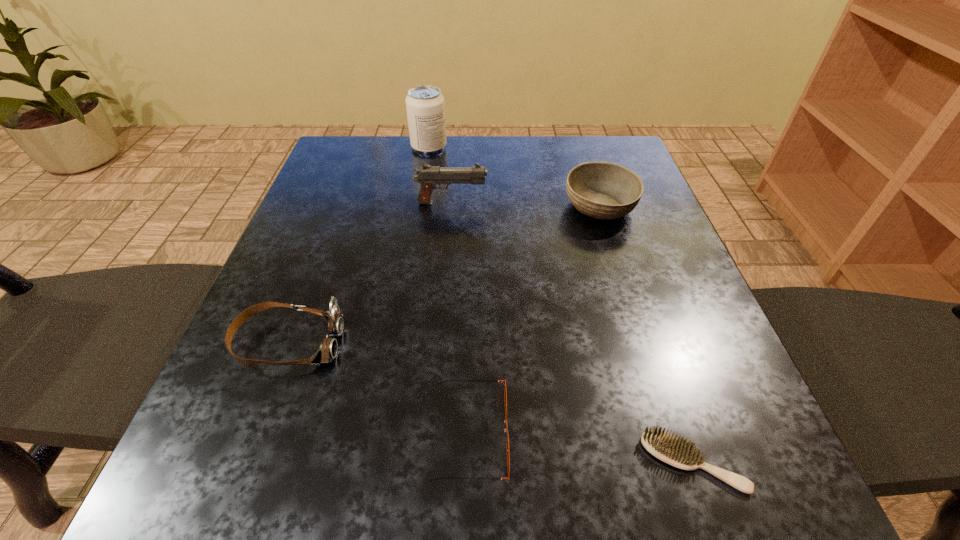
This screenshot has width=960, height=540. Identify the location of soda can. (425, 106).

Locate an element on the screen. This screenshot has width=960, height=540. the farthest object is located at coordinates (425, 106).

Where is `gun`? This screenshot has height=540, width=960. gun is located at coordinates (429, 177).

Find the location of a particular element. The width and height of the screenshot is (960, 540). the third tallest object is located at coordinates (603, 190).

At what (x,y) coordinates should I click in order to perform the action: click on goggles. Please return your answer as a coordinate pair (x, y). Looking at the image, I should click on (327, 351).

Locate an element on the screen. Image resolution: width=960 pixels, height=540 pixels. the leftmost object is located at coordinates (327, 351).

Identify the location of the second shortest object. (502, 381).

Where is `the shortest object`? Image resolution: width=960 pixels, height=540 pixels. the shortest object is located at coordinates (675, 451).

Find the location of a particular element. vacant space located 0.220m on the front of the soda can is located at coordinates (419, 208).

Identify the location of free region located in the direction the gun is aimed. (606, 203).